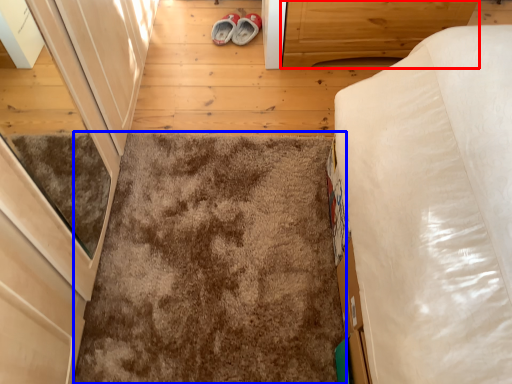
Question: Which object appears farthest to the camera in this image, cabinetry (highlighted by a red box) or mat (highlighted by a blue box)?

Choices:
 (A) cabinetry
 (B) mat

Answer: (A)